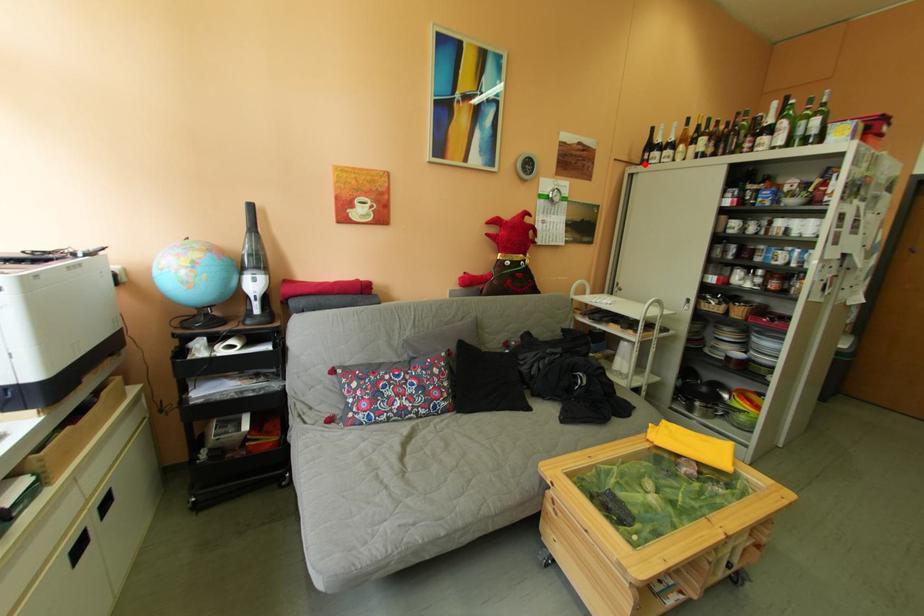
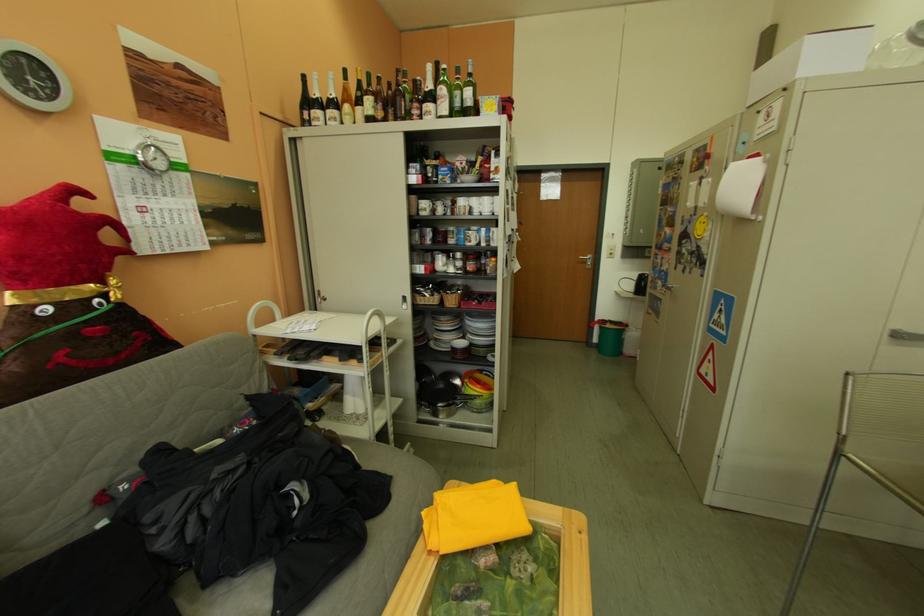
In the second image, find the point that corresponds to the highlighted location in the first image.

(302, 126)